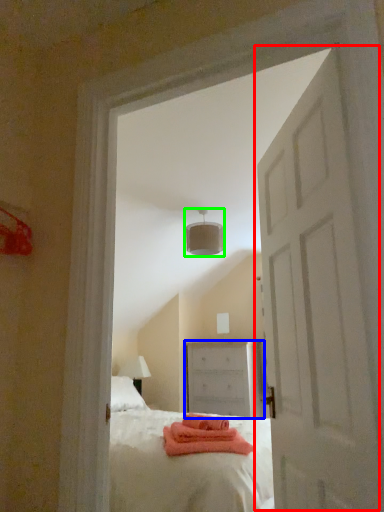
Question: Which is nearer to the door (highlighted by a red box)? chest of drawers (highlighted by a blue box) or lamp (highlighted by a green box).

Choices:
 (A) chest of drawers
 (B) lamp

Answer: (B)